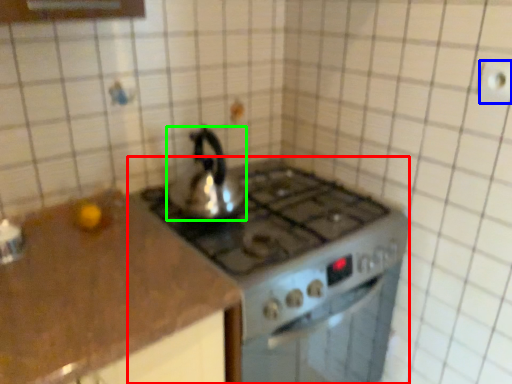
Question: Which is farther away from gas stove (highlighted by a red box)? electric outlet (highlighted by a blue box) or kettle (highlighted by a green box)?

Choices:
 (A) electric outlet
 (B) kettle

Answer: (A)